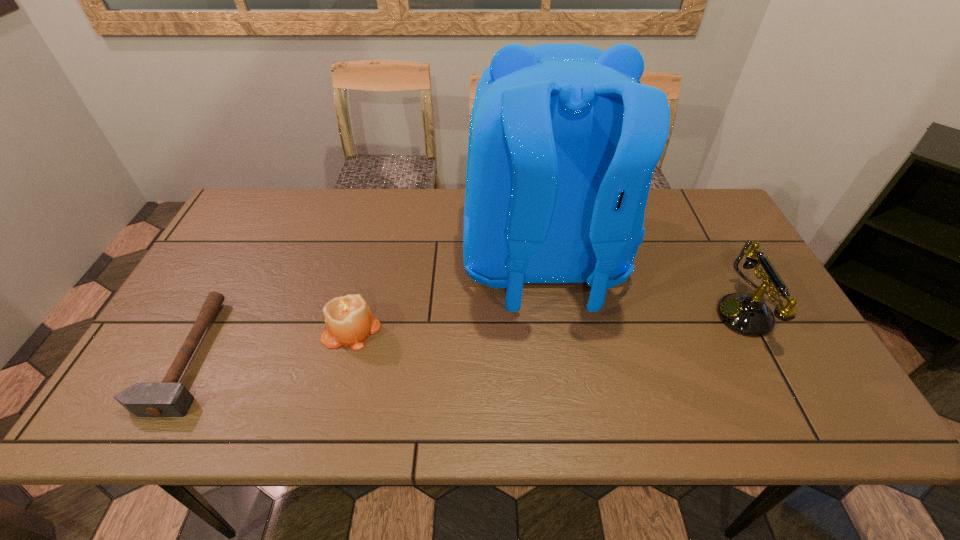
At what (x,y) coordinates should I click in order to perform the action: click on vacant area that lies between the second tallest object and the hammer. Please return your answer as a coordinate pair (x, y). Looking at the image, I should click on [469, 335].

Identify the location of free space between the third shortest object and the shortest object. This screenshot has height=540, width=960. (469, 335).

Where is `vacant region between the third tallest object and the hammer`? Image resolution: width=960 pixels, height=540 pixels. vacant region between the third tallest object and the hammer is located at coordinates (270, 342).

The image size is (960, 540). Find the location of `vacant space that is in between the telephone and the leftmost object`. vacant space that is in between the telephone and the leftmost object is located at coordinates (469, 335).

Identify which object is the third nearest to the telephone. Please provide its 2D coordinates. Your answer should be formatted as a tuple, i.e. [(x, y)], where the tuple contains the x and y coordinates of a point satisfying the conditions above.

[(169, 398)]

You are a GUI agent. You are given a task and a screenshot of the screen. Output one action in this format:
    pyautogui.click(x=<x>, y=<y>)
    Task: Click on the object that is the nearest to the second object from left to right
    This screenshot has height=540, width=960.
    Given the screenshot: What is the action you would take?
    pyautogui.click(x=563, y=140)

At what (x,y) coordinates should I click in order to perform the action: click on free region that satisfies the following two spatial constraints: 1. on the front side of the second shortest object; 2. on the striking surface of the shortest object. Please return your answer as a coordinate pair (x, y). Image resolution: width=960 pixels, height=540 pixels. Looking at the image, I should click on (345, 355).